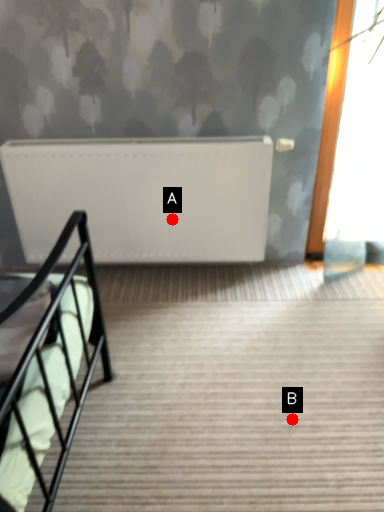
Question: Two points are circled on the image, labeled by A and B beside each circle. Which point is closer to the camera?

Choices:
 (A) A is closer
 (B) B is closer

Answer: (B)